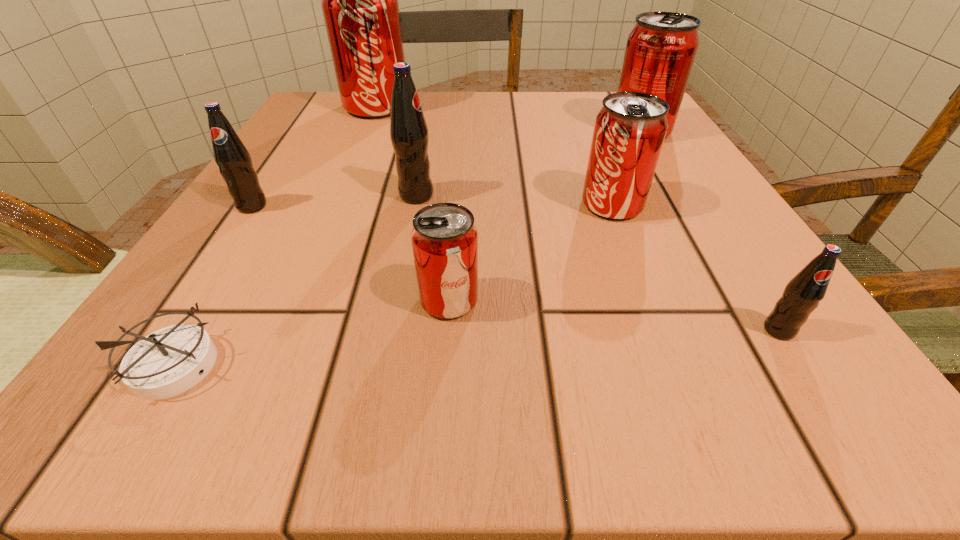
Where is `vacant area that lies between the second black pop from right to left and the rightmost red pop soda`? This screenshot has height=540, width=960. vacant area that lies between the second black pop from right to left and the rightmost red pop soda is located at coordinates (528, 163).

Locate an element on the screen. The image size is (960, 540). the closest object to the second biggest black pop is located at coordinates (409, 135).

Where is `object that is the fifth nearest to the shortest object`? Image resolution: width=960 pixels, height=540 pixels. object that is the fifth nearest to the shortest object is located at coordinates (359, 0).

Locate an element on the screen. This screenshot has width=960, height=540. pop that is the fifth closest to the rightmost red pop soda is located at coordinates (444, 238).

Choose which pop is the third nearest neighbor to the fourth object from left to right. Please provide its 2D coordinates. Your answer should be formatted as a tuple, i.e. [(x, y)], where the tuple contains the x and y coordinates of a point satisfying the conditions above.

[(629, 131)]

Locate an element on the screen. red pop soda that stands as the third closest to the leftmost red pop soda is located at coordinates (444, 238).

Identify the location of red pop soda that can be found as the third closest to the second smallest black pop. (629, 131).

Identify which black pop is the second nearest to the compass. Please provide its 2D coordinates. Your answer should be formatted as a tuple, i.e. [(x, y)], where the tuple contains the x and y coordinates of a point satisfying the conditions above.

[(409, 135)]

Identify the location of the closest black pop to the rightmost red pop soda. Image resolution: width=960 pixels, height=540 pixels. (409, 135).

The height and width of the screenshot is (540, 960). I want to click on vacant area in the image that satisfies the following two spatial constraints: 1. on the front label of the shortest object; 2. on the right side of the second biggest black pop, so click(147, 363).